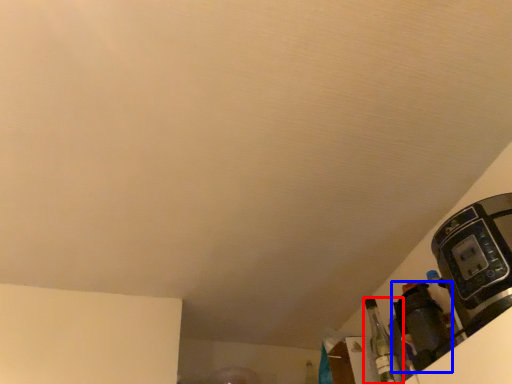
Question: Which point is further to the camera, bottle (highlighted by a red box) or appliance (highlighted by a blue box)?

Choices:
 (A) bottle
 (B) appliance

Answer: (A)